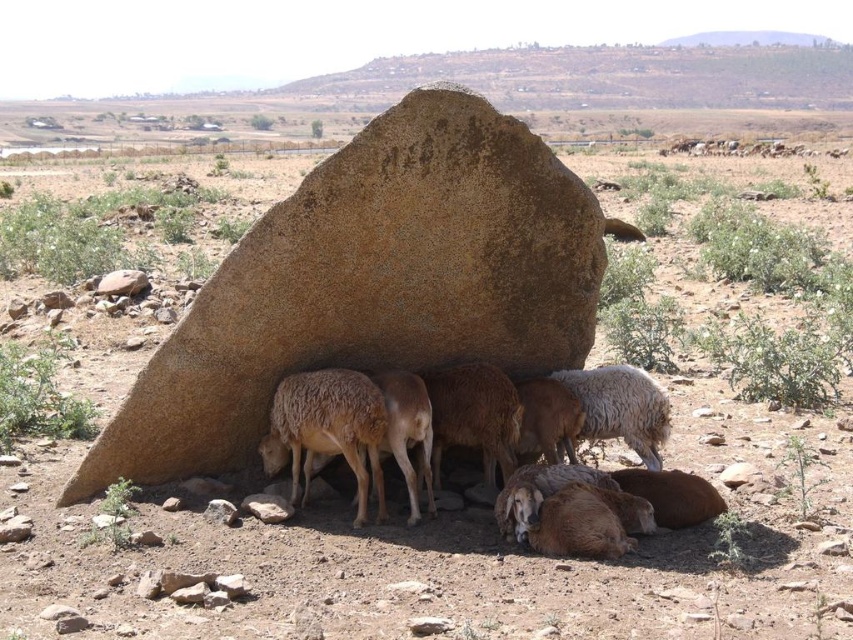
You are a hiker who wants to take a photo of the brown rough rock at center and the white woolly sheep at center. To ensure both are fully visible in the frame, which object should you position closer to the camera?

You should position the brown rough rock at center closer to the camera because it might be wider than the white woolly sheep at center, so moving it forward would help ensure both fit within the photo frame.

You are a photographer trying to capture the brown rough rock at center in your shot. Based on the scene described, where should you position your camera to ensure the rock is centered in the frame?

To center the brown rough rock at center in your frame, position your camera directly at the coordinates specified by the point mentioned in the description, which is at point [370,284].